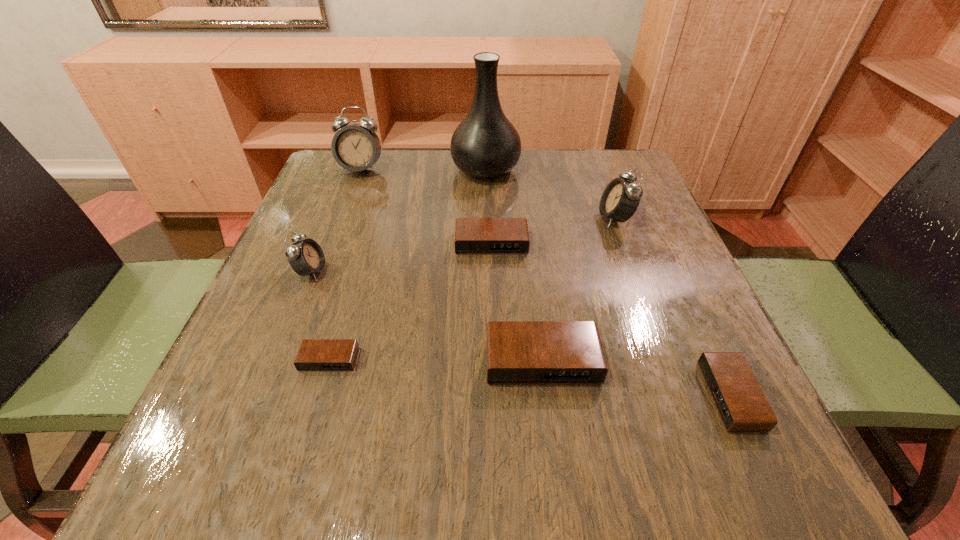
Where is `the farthest black alarm clock`? Image resolution: width=960 pixels, height=540 pixels. the farthest black alarm clock is located at coordinates (473, 236).

Locate an element on the screen. The width and height of the screenshot is (960, 540). the seventh tallest object is located at coordinates 742,406.

Identify the location of the rightmost alarm clock. (742, 406).

Identify the location of the leftmost black alarm clock. The height and width of the screenshot is (540, 960). (314, 354).

The width and height of the screenshot is (960, 540). What are the coordinates of `the shortest alarm clock` in the screenshot? It's located at (314, 354).

Where is `vacant space located on the left of the tallest object`? The height and width of the screenshot is (540, 960). vacant space located on the left of the tallest object is located at coordinates (363, 169).

You are a GUI agent. You are given a task and a screenshot of the screen. Output one action in this format:
    pyautogui.click(x=<x>, y=<y>)
    Task: Click on the free space located on the face of the farthest white alarm clock
    
    Given the screenshot: What is the action you would take?
    pyautogui.click(x=319, y=282)

You are a GUI agent. You are given a task and a screenshot of the screen. Output one action in this format:
    pyautogui.click(x=<x>, y=<y>)
    Task: Click on the vacant area situated 0.070m on the face of the second nearest white alarm clock
    The width and height of the screenshot is (960, 540).
    Given the screenshot: What is the action you would take?
    pyautogui.click(x=567, y=218)

At what (x,y) coordinates should I click in order to perform the action: click on free spot located 0.320m on the face of the second nearest white alarm clock. Please return your answer as a coordinate pair (x, y). Looking at the image, I should click on (455, 218).

Identify the location of free space located on the face of the second nearest white alarm clock. (460, 218).